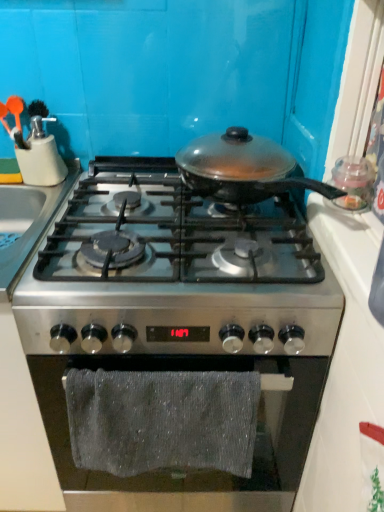
Question: Can you confirm if matte plastic utensil holder at upper left is positioned to the left of stainless steel gas stove at center, which is the first gas stove in top-to-bottom order?

Choices:
 (A) yes
 (B) no

Answer: (A)

Question: Is matte plastic utensil holder at upper left not inside stainless steel gas stove at center, which is the first gas stove in top-to-bottom order?

Choices:
 (A) yes
 (B) no

Answer: (A)

Question: Considering the relative sizes of matte plastic utensil holder at upper left and stainless steel gas stove at center, the second gas stove ordered from the bottom, in the image provided, is matte plastic utensil holder at upper left smaller than stainless steel gas stove at center, the second gas stove ordered from the bottom,?

Choices:
 (A) yes
 (B) no

Answer: (A)

Question: Does matte plastic utensil holder at upper left have a lesser width compared to stainless steel gas stove at center, the second gas stove ordered from the bottom?

Choices:
 (A) yes
 (B) no

Answer: (A)

Question: From a real-world perspective, is matte plastic utensil holder at upper left physically below stainless steel gas stove at center, which is the first gas stove in top-to-bottom order?

Choices:
 (A) no
 (B) yes

Answer: (A)

Question: In terms of width, does gray textured towel at lower center look wider or thinner when compared to matte plastic utensil holder at upper left?

Choices:
 (A) thin
 (B) wide

Answer: (A)

Question: Visually, is gray textured towel at lower center positioned to the left or to the right of matte plastic utensil holder at upper left?

Choices:
 (A) left
 (B) right

Answer: (B)

Question: Considering their positions, is gray textured towel at lower center located in front of or behind matte plastic utensil holder at upper left?

Choices:
 (A) front
 (B) behind

Answer: (A)

Question: Do you think gray textured towel at lower center is within matte plastic utensil holder at upper left, or outside of it?

Choices:
 (A) outside
 (B) inside

Answer: (A)

Question: Would you say stainless steel gas stove at center, the second gas stove ordered from the bottom, is inside or outside matte plastic utensil holder at upper left?

Choices:
 (A) inside
 (B) outside

Answer: (B)

Question: Considering the positions of stainless steel gas stove at center, the second gas stove ordered from the bottom, and matte plastic utensil holder at upper left in the image, is stainless steel gas stove at center, the second gas stove ordered from the bottom, wider or thinner than matte plastic utensil holder at upper left?

Choices:
 (A) wide
 (B) thin

Answer: (A)

Question: Looking at the image, does stainless steel gas stove at center, the second gas stove ordered from the bottom, seem bigger or smaller compared to matte plastic utensil holder at upper left?

Choices:
 (A) small
 (B) big

Answer: (B)

Question: Based on their positions, is stainless steel gas stove at center, which is the first gas stove in top-to-bottom order, located to the left or right of matte plastic utensil holder at upper left?

Choices:
 (A) left
 (B) right

Answer: (B)

Question: From the image's perspective, relative to gray textured towel at lower center, is stainless steel gas stove at center, which is the first gas stove in top-to-bottom order, above or below?

Choices:
 (A) above
 (B) below

Answer: (A)

Question: Considering the positions of stainless steel gas stove at center, which is the first gas stove in top-to-bottom order, and gray textured towel at lower center in the image, is stainless steel gas stove at center, which is the first gas stove in top-to-bottom order, wider or thinner than gray textured towel at lower center?

Choices:
 (A) thin
 (B) wide

Answer: (B)